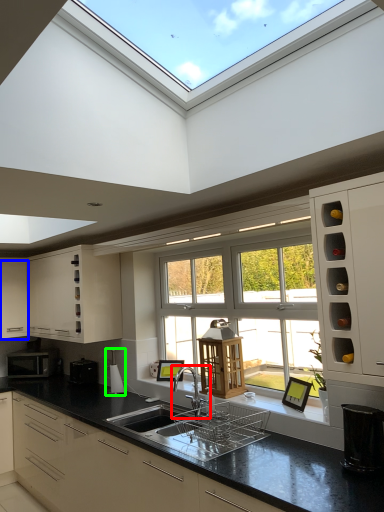
Question: Which is farther away from tap (highlighted by a red box)? cabinetry (highlighted by a blue box) or appliance (highlighted by a green box)?

Choices:
 (A) cabinetry
 (B) appliance

Answer: (A)